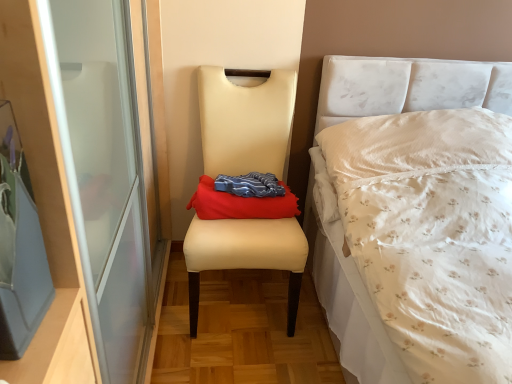
The height and width of the screenshot is (384, 512). I want to click on free location above red fabric throw pillow at center (from a real-world perspective), so click(x=250, y=184).